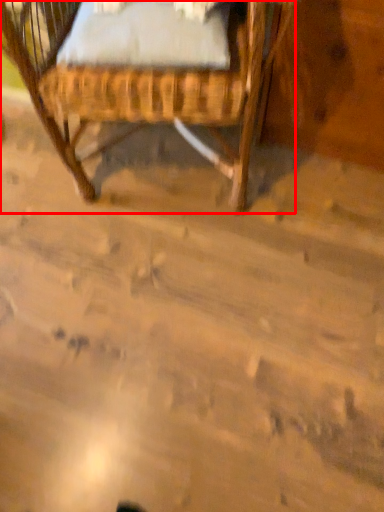
Question: From the image, what is the correct spatial relationship of chair (annotated by the red box) in relation to sheet?

Choices:
 (A) left
 (B) right

Answer: (A)